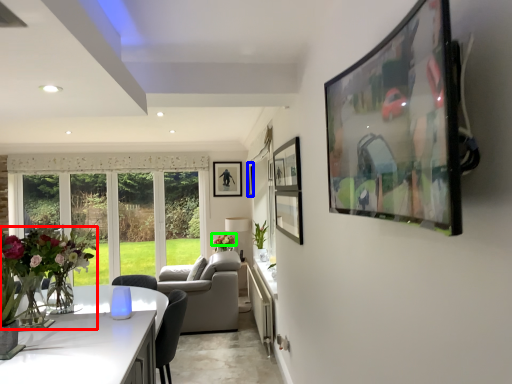
Question: Which object is positioned farthest from floral arrangement (highlighted by a red box)? Select from picture frame (highlighted by a blue box) and flower (highlighted by a green box).

Choices:
 (A) picture frame
 (B) flower

Answer: (A)